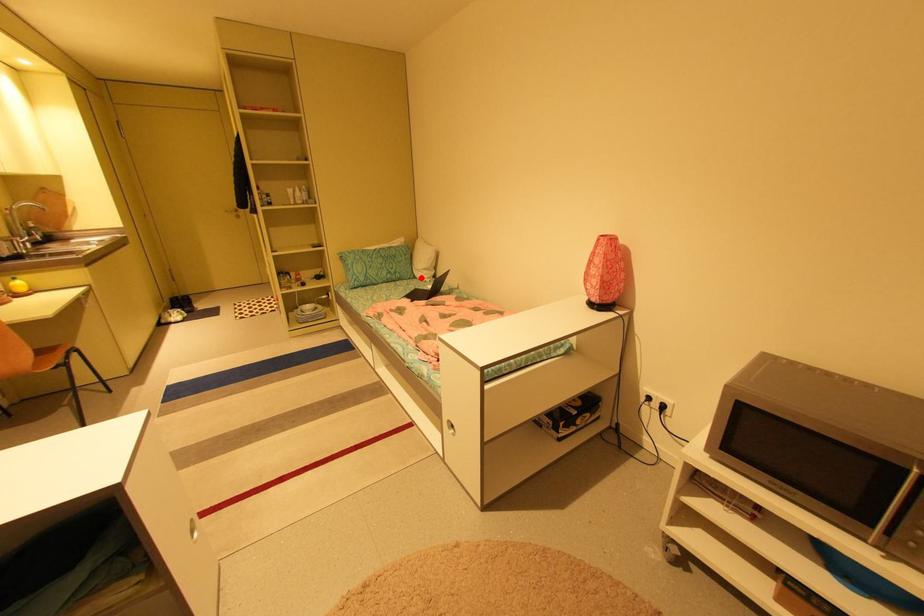
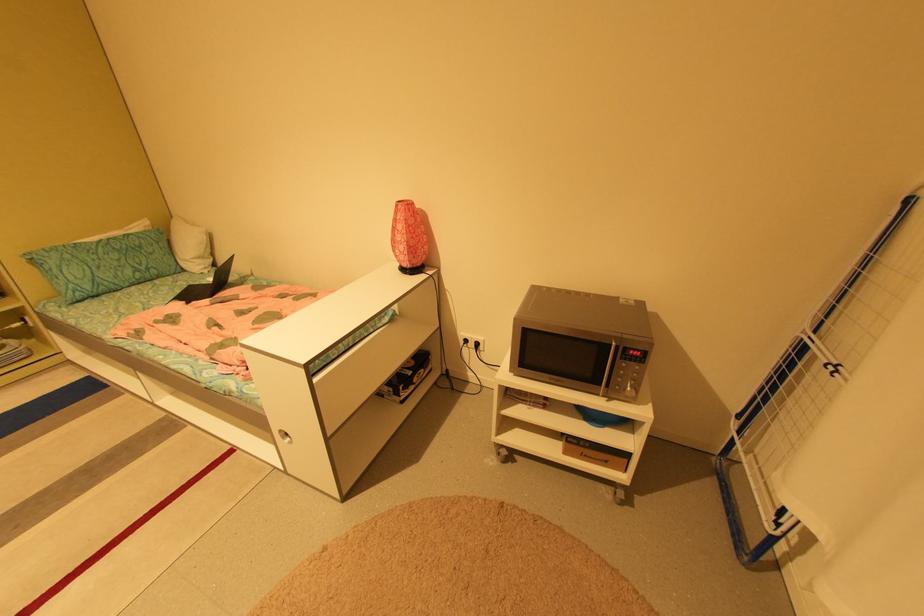
The point at the highlighted location is marked in the first image. Where is the corresponding point in the second image?

(190, 270)